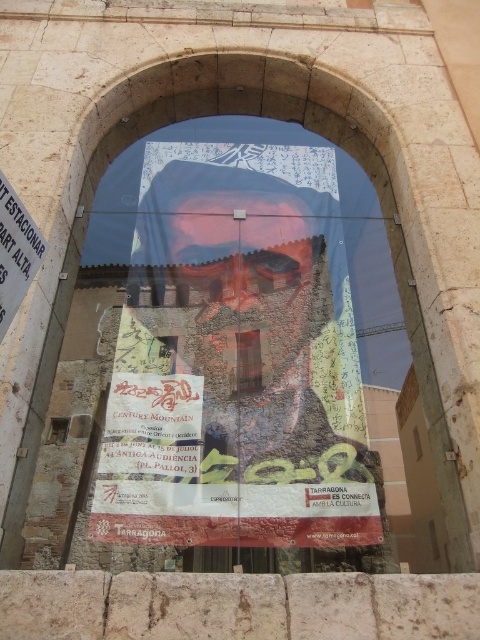
Question: Which point is farther to the camera?

Choices:
 (A) matte paper poster at center
 (B) matte blue poster at center

Answer: (A)

Question: Does matte blue poster at center lie in front of matte paper poster at center?

Choices:
 (A) no
 (B) yes

Answer: (B)

Question: Which point appears farthest from the camera in this image?

Choices:
 (A) (9, 259)
 (B) (199, 168)

Answer: (B)

Question: Does matte blue poster at center appear over matte paper poster at center?

Choices:
 (A) no
 (B) yes

Answer: (A)

Question: Is matte blue poster at center to the left of matte paper poster at center from the viewer's perspective?

Choices:
 (A) yes
 (B) no

Answer: (B)

Question: Among these objects, which one is nearest to the camera?

Choices:
 (A) matte blue poster at center
 (B) matte paper poster at center

Answer: (A)